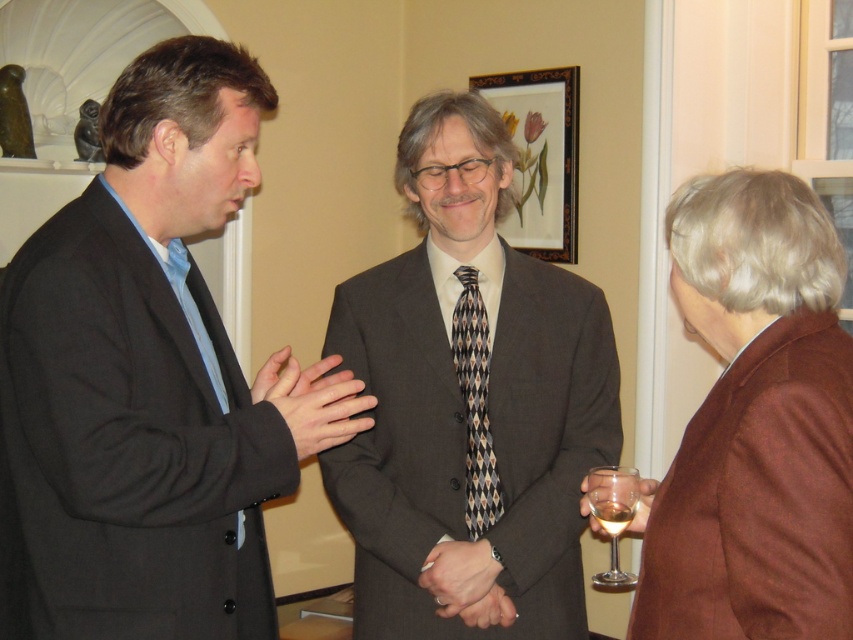
Question: Does brown woolen jacket at right come behind clear glass at lower right?

Choices:
 (A) no
 (B) yes

Answer: (A)

Question: Observing the image, what is the correct spatial positioning of dark gray suit at center in reference to matte black hands at center?

Choices:
 (A) above
 (B) below

Answer: (A)

Question: Considering the relative positions of clear glass wine glass at lower right and clear glass at lower right in the image provided, where is clear glass wine glass at lower right located with respect to clear glass at lower right?

Choices:
 (A) left
 (B) right

Answer: (B)

Question: Which object appears farthest from the camera in this image?

Choices:
 (A) brown woolen jacket at right
 (B) clear glass at lower right
 (C) clear glass wine glass at lower right

Answer: (C)

Question: Which point is farther to the camera?

Choices:
 (A) matte black suit at left
 (B) clear glass at lower right
 (C) brown woolen jacket at right

Answer: (B)

Question: Which point is closer to the camera?

Choices:
 (A) matte black hands at center
 (B) matte black suit at left

Answer: (B)